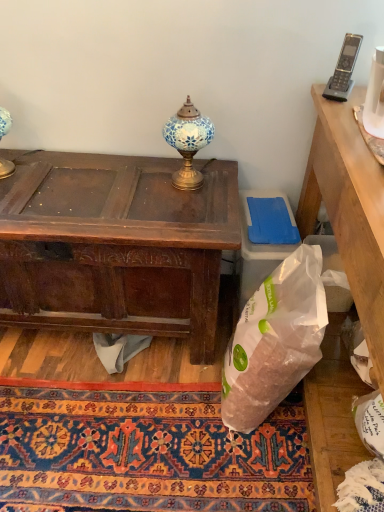
Find the location of `free space above dark brown wood desk at center (from a real-world perspective)`. free space above dark brown wood desk at center (from a real-world perspective) is located at coordinates (95, 189).